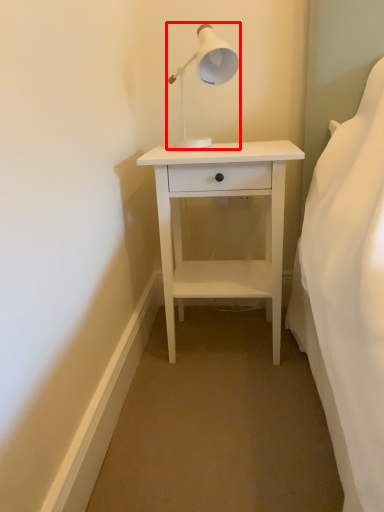
Question: Considering the relative positions of lamp (annotated by the red box) and nightstand in the image provided, where is lamp (annotated by the red box) located with respect to the staircase?

Choices:
 (A) right
 (B) left

Answer: (B)